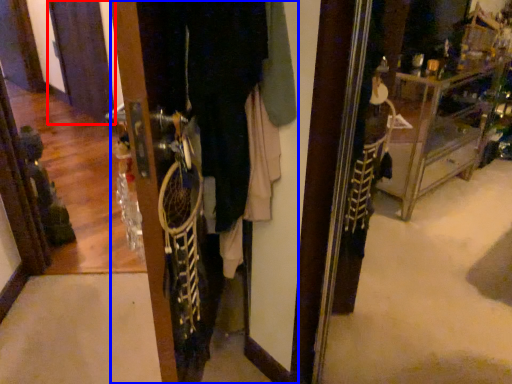
Question: Which object appears closest to the camera in this image, screen door (highlighted by a red box) or closet (highlighted by a blue box)?

Choices:
 (A) screen door
 (B) closet

Answer: (B)